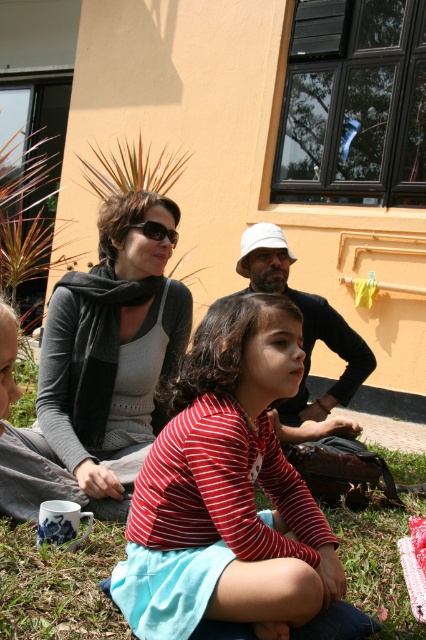
You are standing in front of the building and see the striped cotton shirt at center. Can you determine its exact location based on the coordinate system provided?

The striped cotton shirt at center is located at point (227, 490).

You are planning to place a small decorative item on the green grass at lower center. However, there is a striped cotton shirt at center nearby. Considering their widths, which area has more space for placement?

The striped cotton shirt at center has a greater width than the green grass at lower center, so placing the item on the green grass at lower center may have less space available compared to the striped cotton shirt at center.

You are standing in the scene and want to hand a drink to the person wearing the matte black shirt at center without accidentally dropping it on the black plastic sunglasses at center. Which item should you aim for first?

The matte black shirt at center is in front of the black plastic sunglasses at center, so you should aim for the matte black shirt at center first to avoid dropping the drink on the sunglasses.